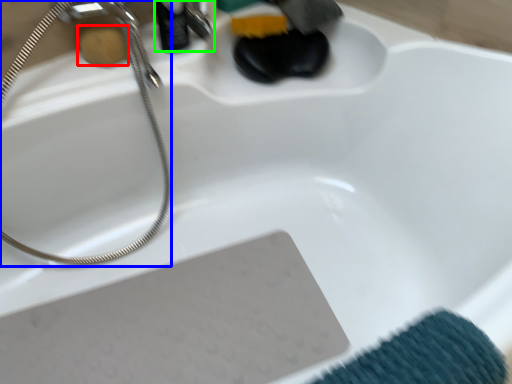
Question: Estimate the real-world distances between objects in this image. Which object is farther from soap (highlighted by a red box), shower (highlighted by a blue box) or faucet (highlighted by a green box)?

Choices:
 (A) shower
 (B) faucet

Answer: (A)